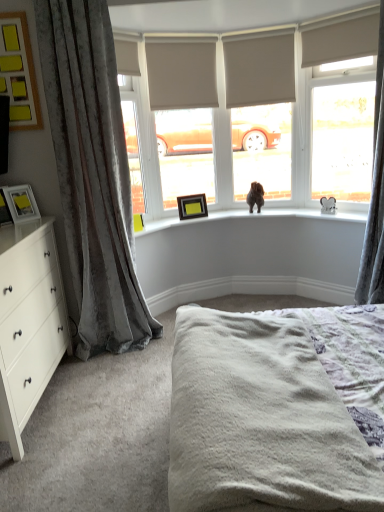
Find the location of a particular element. free space to the back side of white plush toy at upper right, the 1th animal from the right is located at coordinates (319, 210).